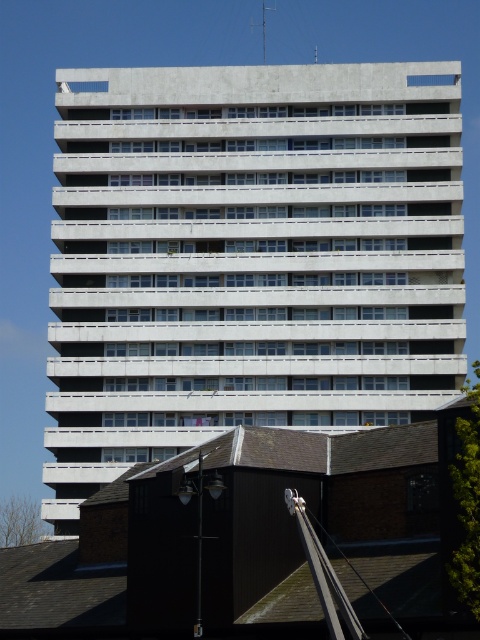
Is gray concrete building at center to the right of metallic silver crane at upper center from the viewer's perspective?

Yes, gray concrete building at center is to the right of metallic silver crane at upper center.

I want to click on gray concrete building at center, so click(x=249, y=257).